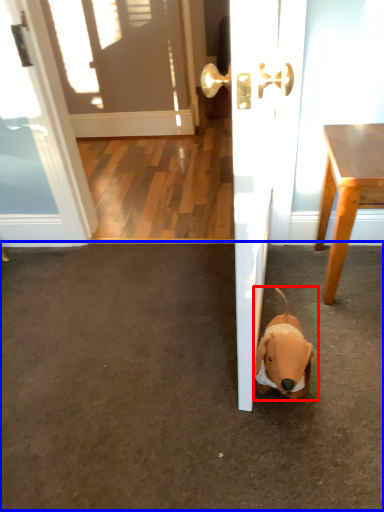
Question: Which object appears farthest to the camera in this image, dog (highlighted by a red box) or concrete (highlighted by a blue box)?

Choices:
 (A) dog
 (B) concrete

Answer: (A)